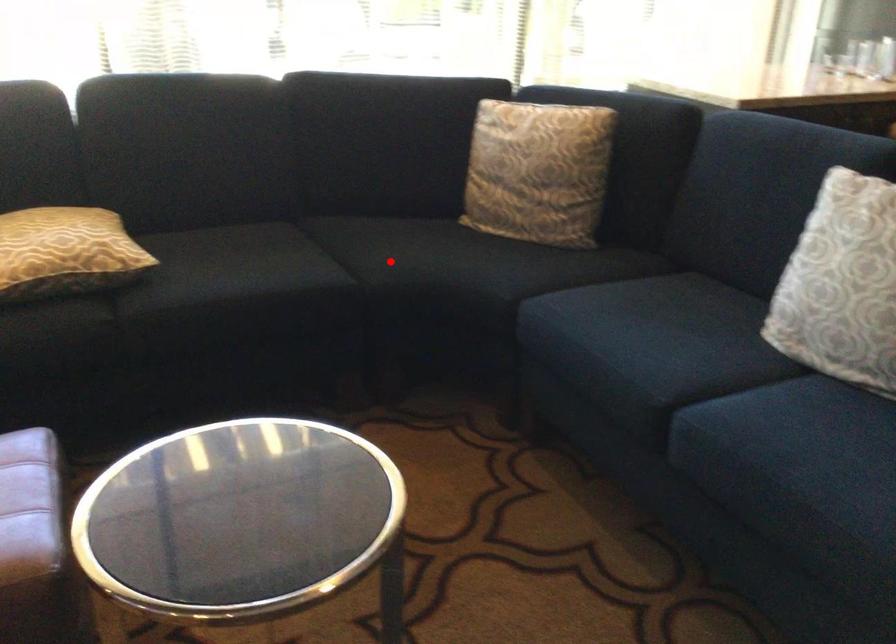
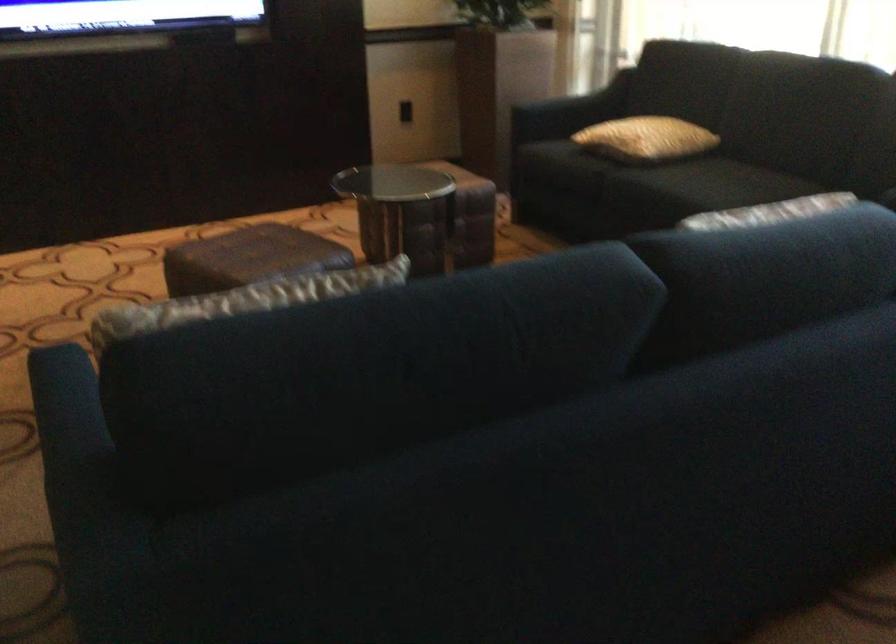
Question: I am providing you with two images of the same scene from different viewpoints. A red point is marked on the first image. Is the red point's position out of view in image 2?

Choices:
 (A) Yes
 (B) No

Answer: (A)